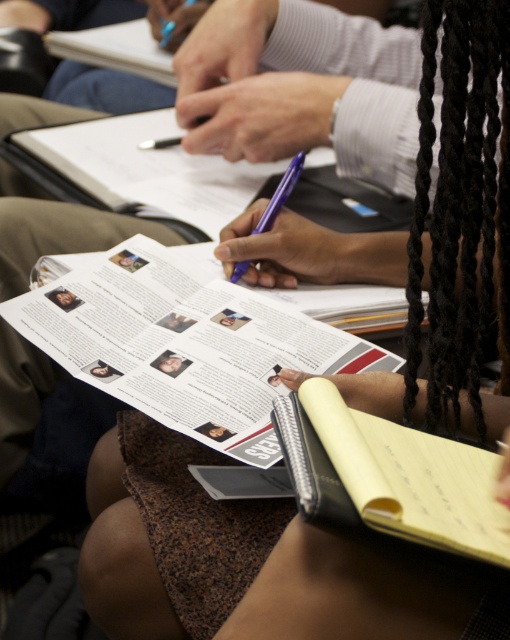
Is point (375, 353) positioned in front of point (264, 221)?

Yes, it is in front of point (264, 221).

Does yellow paper at center appear on the right side of purple plastic pen at center?

Incorrect, yellow paper at center is not on the right side of purple plastic pen at center.

Who is more forward, (147, 394) or (261, 227)?

Point (147, 394) is in front.

You are a GUI agent. You are given a task and a screenshot of the screen. Output one action in this format:
    pyautogui.click(x=<x>, y=<y>)
    Task: Click on the yellow paper at center
    
    Given the screenshot: What is the action you would take?
    pyautogui.click(x=184, y=342)

Find the location of a particular element. This screenshot has width=510, height=640. yellow paper at center is located at coordinates (184, 342).

The height and width of the screenshot is (640, 510). Describe the element at coordinates (184, 342) in the screenshot. I see `yellow paper at center` at that location.

Locate an element on the screen. This screenshot has height=640, width=510. yellow paper at center is located at coordinates (184, 342).

The width and height of the screenshot is (510, 640). Describe the element at coordinates (397, 476) in the screenshot. I see `yellow paper notebook at lower right` at that location.

Does yellow paper notebook at lower right appear under purple plastic pen at center?

Yes.

This screenshot has height=640, width=510. Describe the element at coordinates (397, 476) in the screenshot. I see `yellow paper notebook at lower right` at that location.

The image size is (510, 640). Identify the location of yellow paper notebook at lower right. (397, 476).